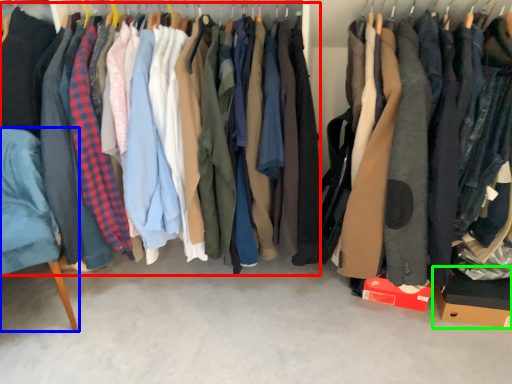
Question: Based on their relative distances, which object is nearer to closet (highlighted by a red box)? Choose from furniture (highlighted by a blue box) and cardboard box (highlighted by a green box).

Choices:
 (A) furniture
 (B) cardboard box

Answer: (A)